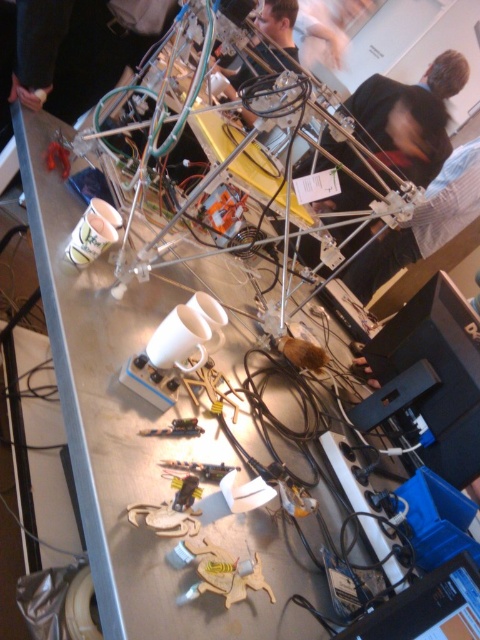
Question: Does matte black laptop at upper left have a greater width compared to matte black person at upper center?

Choices:
 (A) no
 (B) yes

Answer: (B)

Question: Among these objects, which one is nearest to the camera?

Choices:
 (A) matte black laptop at upper left
 (B) matte black person at upper center

Answer: (A)

Question: From the image, what is the correct spatial relationship of matte black laptop at upper left in relation to matte black person at upper center?

Choices:
 (A) left
 (B) right

Answer: (A)

Question: Can you confirm if matte black laptop at upper left is smaller than matte black person at upper center?

Choices:
 (A) yes
 (B) no

Answer: (A)

Question: Which of the following is the closest to the observer?

Choices:
 (A) matte black laptop at upper left
 (B) matte black person at upper center

Answer: (A)